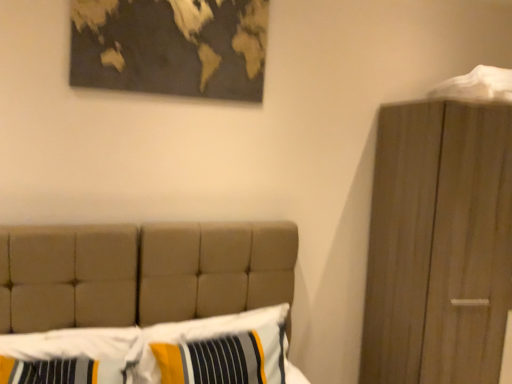
Question: In the image, is textured beige bed at center positioned in front of or behind striped fabric pillow at lower left, which appears as the 1th pillow when viewed from the left?

Choices:
 (A) behind
 (B) front

Answer: (B)

Question: Is point (117, 296) positioned closer to the camera than point (82, 365)?

Choices:
 (A) farther
 (B) closer

Answer: (A)

Question: Estimate the real-world distances between objects in this image. Which object is closer to the textured beige bed at center?

Choices:
 (A) gold metallic map at upper center
 (B) striped fabric pillow at center, arranged as the second pillow when viewed from the left
 (C) white fabric at upper right
 (D) striped fabric pillow at lower left, which appears as the 1th pillow when viewed from the left

Answer: (B)

Question: Based on their relative distances, which object is nearer to the striped fabric pillow at center, the first pillow viewed from the right?

Choices:
 (A) textured beige bed at center
 (B) gold metallic map at upper center
 (C) white fabric at upper right
 (D) striped fabric pillow at lower left, the second pillow viewed from the right

Answer: (A)